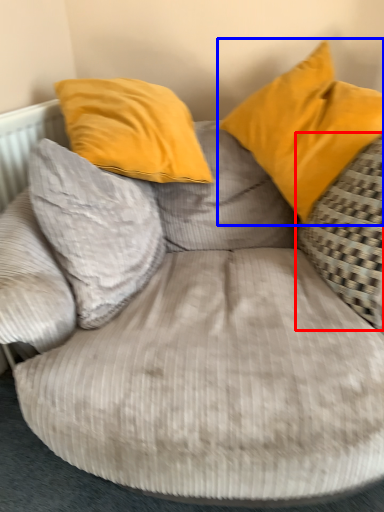
Question: Among these objects, which one is farthest to the camera, pillow (highlighted by a red box) or pillow (highlighted by a blue box)?

Choices:
 (A) pillow
 (B) pillow

Answer: (B)